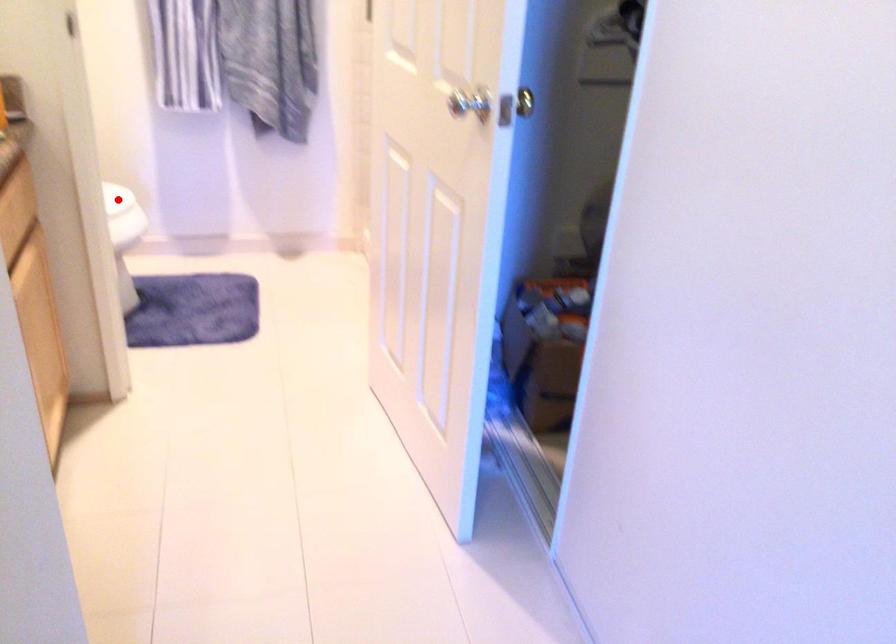
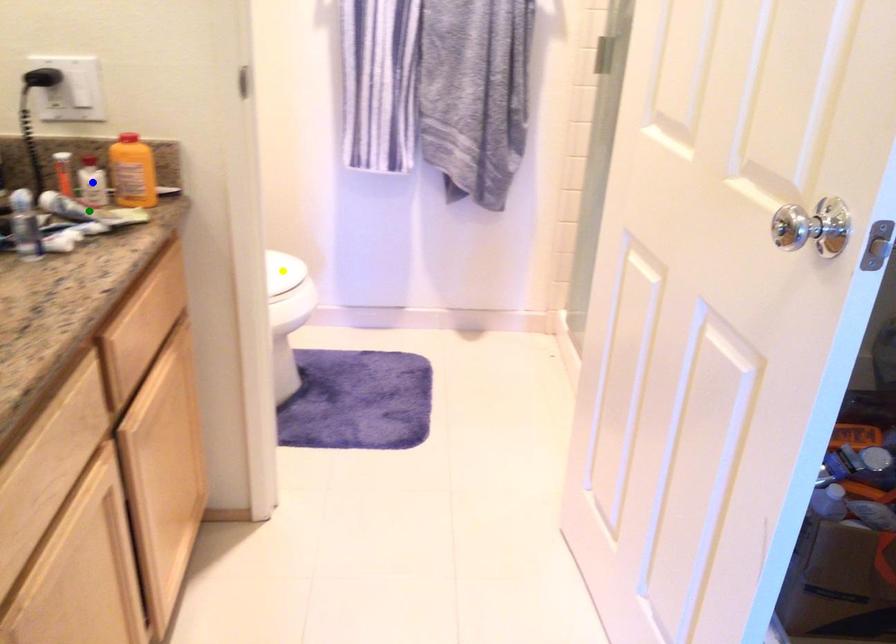
Question: I am providing you with two images of the same scene from different viewpoints. A red point is marked on the first image. You are given multiple points on the second image. In image 2, which mark is for the same physical point as the one in image 1?

Choices:
 (A) green point
 (B) blue point
 (C) yellow point

Answer: (C)